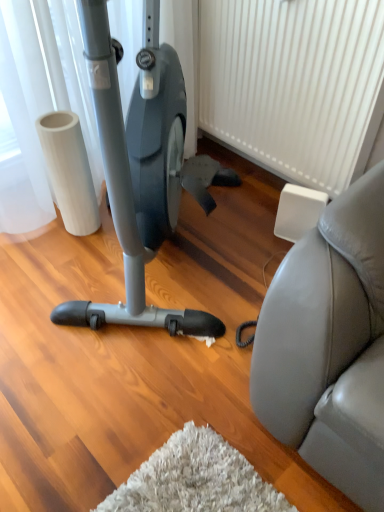
Question: Can you confirm if matte black stationary bicycle at center is wider than white textured radiator at center?

Choices:
 (A) yes
 (B) no

Answer: (A)

Question: Is matte black stationary bicycle at center positioned far away from white textured radiator at center?

Choices:
 (A) no
 (B) yes

Answer: (A)

Question: Is matte black stationary bicycle at center at the right side of white textured radiator at center?

Choices:
 (A) yes
 (B) no

Answer: (B)

Question: From a real-world perspective, is matte black stationary bicycle at center positioned under white textured radiator at center based on gravity?

Choices:
 (A) yes
 (B) no

Answer: (B)

Question: Is the surface of matte black stationary bicycle at center in direct contact with white textured radiator at center?

Choices:
 (A) yes
 (B) no

Answer: (B)

Question: Is matte black stationary bicycle at center located outside white textured radiator at center?

Choices:
 (A) yes
 (B) no

Answer: (A)

Question: From the image's perspective, is white textured radiator at center located above matte black stationary bicycle at center?

Choices:
 (A) yes
 (B) no

Answer: (A)

Question: Is white textured radiator at center wider than matte black stationary bicycle at center?

Choices:
 (A) no
 (B) yes

Answer: (A)

Question: Is white textured radiator at center touching matte black stationary bicycle at center?

Choices:
 (A) yes
 (B) no

Answer: (B)

Question: Is white textured radiator at center not near matte black stationary bicycle at center?

Choices:
 (A) no
 (B) yes

Answer: (A)

Question: Does white textured radiator at center have a greater height compared to matte black stationary bicycle at center?

Choices:
 (A) yes
 (B) no

Answer: (B)

Question: Does white textured radiator at center have a lesser width compared to matte black stationary bicycle at center?

Choices:
 (A) no
 (B) yes

Answer: (B)

Question: Looking at the image, does matte black stationary bicycle at center seem bigger or smaller compared to white textured radiator at center?

Choices:
 (A) small
 (B) big

Answer: (B)